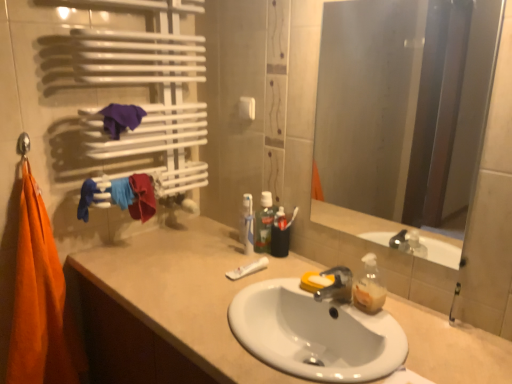
The height and width of the screenshot is (384, 512). What do you see at coordinates (40, 301) in the screenshot? I see `orange cotton towel at left, which ranks as the second beach towel in right-to-left order` at bounding box center [40, 301].

Measure the distance between point (331, 352) and camera.

Point (331, 352) and camera are 3.95 feet apart from each other.

What is the approximate height of purple fabric at upper left, acting as the 2th beach towel starting from the left?

purple fabric at upper left, acting as the 2th beach towel starting from the left, is 5.60 inches tall.

You are a GUI agent. You are given a task and a screenshot of the screen. Output one action in this format:
    pyautogui.click(x=<x>, y=<y>)
    Task: Click on the green translucent mouthwash at center
    The height and width of the screenshot is (384, 512).
    Given the screenshot: What is the action you would take?
    pyautogui.click(x=264, y=223)

What are the coordinates of `translucent plastic toothpaste at center` in the screenshot? It's located at (247, 224).

Where is `beige matte cabinet at lower left`? Image resolution: width=512 pixels, height=384 pixels. beige matte cabinet at lower left is located at coordinates (170, 307).

At what (x,y) coordinates should I click in order to perform the action: click on smooth glass mirror at center. Please return your answer as a coordinate pair (x, y). The width and height of the screenshot is (512, 384). Looking at the image, I should click on (400, 101).

Based on the photo, from a real-world perspective, which is physically above, orange cotton towel at left, placed as the 2th beach towel when sorted from top to bottom, or green translucent mouthwash at center?

In real-world perspective, green translucent mouthwash at center is above.

Considering the sizes of objects orange cotton towel at left, which is the first beach towel in bottom-to-top order, and green translucent mouthwash at center in the image provided, who is shorter, orange cotton towel at left, which is the first beach towel in bottom-to-top order, or green translucent mouthwash at center?

With less height is green translucent mouthwash at center.

Considering the relative sizes of orange cotton towel at left, the 1th beach towel in the left-to-right sequence, and green translucent mouthwash at center in the image provided, is orange cotton towel at left, the 1th beach towel in the left-to-right sequence, smaller than green translucent mouthwash at center?

Actually, orange cotton towel at left, the 1th beach towel in the left-to-right sequence, might be larger than green translucent mouthwash at center.

I want to click on mouthwash behind the orange cotton towel at left, the 1th beach towel in the left-to-right sequence, so click(264, 223).

Which of these two, smooth glass mirror at center or beige matte cabinet at lower left, stands taller?

beige matte cabinet at lower left is taller.

Where is `mirror lying behind the beige matte cabinet at lower left`? Image resolution: width=512 pixels, height=384 pixels. mirror lying behind the beige matte cabinet at lower left is located at coordinates (400, 101).

Is smooth glass mirror at center in contact with beige matte cabinet at lower left?

No, smooth glass mirror at center is not in contact with beige matte cabinet at lower left.

From the image's perspective, which object appears higher, smooth glass mirror at center or beige matte cabinet at lower left?

From the image's view, smooth glass mirror at center is above.

Is purple fabric at upper left, positioned as the 2th beach towel in bottom-to-top order, positioned beyond the bounds of white matte toothpaste at center?

purple fabric at upper left, positioned as the 2th beach towel in bottom-to-top order, is positioned outside white matte toothpaste at center.

From a real-world perspective, is purple fabric at upper left, which ranks as the 1th beach towel in top-to-bottom order, positioned above or below white matte toothpaste at center?

Clearly, from a real-world perspective, purple fabric at upper left, which ranks as the 1th beach towel in top-to-bottom order, is above white matte toothpaste at center.

In the scene shown: Would you consider purple fabric at upper left, acting as the 2th beach towel starting from the left, to be distant from white matte toothpaste at center?

They are positioned close to each other.

Can you see translucent plastic toothpaste at center touching white matte toothpaste at center?

No, translucent plastic toothpaste at center is not beside white matte toothpaste at center.

Does translucent plastic toothpaste at center contain white matte toothpaste at center?

That's incorrect, white matte toothpaste at center is not inside translucent plastic toothpaste at center.

Considering the sizes of objects translucent plastic toothpaste at center and white matte toothpaste at center in the image provided, who is wider, translucent plastic toothpaste at center or white matte toothpaste at center?

Wider between the two is white matte toothpaste at center.

Is translucent plastic toothpaste at center bigger or smaller than white matte toothpaste at center?

Clearly, translucent plastic toothpaste at center is larger in size than white matte toothpaste at center.

Considering the positions of point (268, 225) and point (126, 107), is point (268, 225) closer or farther from the camera than point (126, 107)?

Point (268, 225) appears to be farther away from the viewer than point (126, 107).

Is green translucent mouthwash at center aimed at purple fabric at upper left, the first beach towel positioned from the right?

No, green translucent mouthwash at center is not aimed at purple fabric at upper left, the first beach towel positioned from the right.

Considering the relative positions of green translucent mouthwash at center and purple fabric at upper left, positioned as the 2th beach towel in bottom-to-top order, in the image provided, is green translucent mouthwash at center to the left or to the right of purple fabric at upper left, positioned as the 2th beach towel in bottom-to-top order,?

Clearly, green translucent mouthwash at center is on the right of purple fabric at upper left, positioned as the 2th beach towel in bottom-to-top order, in the image.

Is green translucent mouthwash at center shorter than purple fabric at upper left, which ranks as the 1th beach towel in top-to-bottom order?

No.

How far apart are white matte toothpaste at center and smooth glass mirror at center?

white matte toothpaste at center and smooth glass mirror at center are 2.37 meters apart from each other.

Is white matte toothpaste at center to the left of smooth glass mirror at center from the viewer's perspective?

Yes, white matte toothpaste at center is to the left of smooth glass mirror at center.

Based on the photo, could you tell me if white matte toothpaste at center is turned towards smooth glass mirror at center?

No, white matte toothpaste at center is not facing towards smooth glass mirror at center.

Who is more distant, white matte toothpaste at center or white ceramic sink at center?

white matte toothpaste at center is further away from the camera.

Is white matte toothpaste at center not close to white ceramic sink at center?

white matte toothpaste at center is actually quite close to white ceramic sink at center.

What's the angular difference between white matte toothpaste at center and white ceramic sink at center's facing directions?

The angle between the facing direction of white matte toothpaste at center and the facing direction of white ceramic sink at center is 0.000118 degrees.

At what (x,y) coordinates should I click in order to perform the action: click on mouthwash that is above the orange cotton towel at left, which ranks as the second beach towel in right-to-left order (from a real-world perspective). Please return your answer as a coordinate pair (x, y). This screenshot has height=384, width=512. Looking at the image, I should click on (264, 223).

In order to click on bathroom cabinet beneath the smooth glass mirror at center (from a real-world perspective) in this screenshot , I will do `click(170, 307)`.

From the image, which object appears to be nearer to white matte toothpaste at center, beige matte cabinet at lower left or smooth glass mirror at center?

beige matte cabinet at lower left lies closer to white matte toothpaste at center than the other object.

From the image, which object appears to be farther from smooth glass mirror at center, beige matte cabinet at lower left or green translucent mouthwash at center?

Based on the image, green translucent mouthwash at center appears to be further to smooth glass mirror at center.

From the image, which object appears to be nearer to purple fabric at upper left, positioned as the 2th beach towel in bottom-to-top order, white matte toothpaste at center or beige matte cabinet at lower left?

beige matte cabinet at lower left is closer to purple fabric at upper left, positioned as the 2th beach towel in bottom-to-top order.

Based on their spatial positions, is purple fabric at upper left, which ranks as the 1th beach towel in top-to-bottom order, or beige matte cabinet at lower left closer to white matte toothpaste at center?

beige matte cabinet at lower left is closer to white matte toothpaste at center.

From the image, which object appears to be nearer to purple fabric at upper left, the first beach towel positioned from the right, white matte toothpaste at center or smooth glass mirror at center?

Among the two, white matte toothpaste at center is located nearer to purple fabric at upper left, the first beach towel positioned from the right.

Looking at the image, which one is located further to translucent plastic toothpaste at center, beige matte cabinet at lower left or smooth glass mirror at center?

Among the two, smooth glass mirror at center is located further to translucent plastic toothpaste at center.

Which object lies further to the anchor point orange cotton towel at left, which ranks as the second beach towel in right-to-left order, smooth glass mirror at center or green translucent mouthwash at center?

The object further to orange cotton towel at left, which ranks as the second beach towel in right-to-left order, is smooth glass mirror at center.

From the image, which object appears to be farther from beige matte cabinet at lower left, green translucent mouthwash at center or translucent plastic toothpaste at center?

Among the two, green translucent mouthwash at center is located further to beige matte cabinet at lower left.

Find the location of `toothpaste located between orange cotton towel at left, placed as the 2th beach towel when sorted from top to bottom, and smooth glass mirror at center in the left-right direction`. toothpaste located between orange cotton towel at left, placed as the 2th beach towel when sorted from top to bottom, and smooth glass mirror at center in the left-right direction is located at coordinates (248, 269).

Locate an element on the screen. bottle situated between purple fabric at upper left, acting as the 2th beach towel starting from the left, and green translucent mouthwash at center from left to right is located at coordinates (247, 224).

The image size is (512, 384). What are the coordinates of `mirror between white ceramic sink at center and green translucent mouthwash at center along the z-axis` in the screenshot? It's located at (400, 101).

Locate an element on the screen. This screenshot has width=512, height=384. bottle located between beige matte cabinet at lower left and green translucent mouthwash at center in the depth direction is located at coordinates (247, 224).